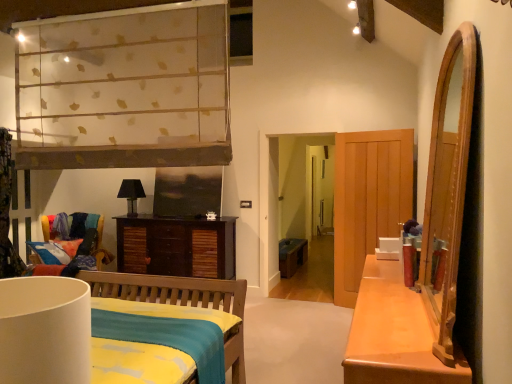
Locate an element on the screen. This screenshot has height=384, width=512. dark brown wood cabinet at center is located at coordinates (176, 246).

What do you see at coordinates (176, 246) in the screenshot?
I see `dark brown wood cabinet at center` at bounding box center [176, 246].

What do you see at coordinates (292, 255) in the screenshot? The width and height of the screenshot is (512, 384). I see `teal fabric bench at center` at bounding box center [292, 255].

Where is `dark brown wood cabinet at center`? This screenshot has width=512, height=384. dark brown wood cabinet at center is located at coordinates (176, 246).

Where is `lamp that appears in front of the dark brown wood cabinet at center`? This screenshot has height=384, width=512. lamp that appears in front of the dark brown wood cabinet at center is located at coordinates (45, 330).

In the image, is dark brown wood cabinet at center on the left side or the right side of white matte lampshade at lower left, the 2th lamp in the left-to-right sequence?

In the image, dark brown wood cabinet at center appears on the left side of white matte lampshade at lower left, the 2th lamp in the left-to-right sequence.

Is dark brown wood cabinet at center located outside white matte lampshade at lower left, which is counted as the 2th lamp, starting from the back?

That's correct, dark brown wood cabinet at center is outside of white matte lampshade at lower left, which is counted as the 2th lamp, starting from the back.

Would you say teal fabric bench at center is outside matte black lampshade at center, the 2th lamp when ordered from right to left?

Yes.

Considering the relative positions of teal fabric bench at center and matte black lampshade at center, the first lamp in the left-to-right sequence, in the image provided, is teal fabric bench at center to the left or to the right of matte black lampshade at center, the first lamp in the left-to-right sequence,?

Based on their positions, teal fabric bench at center is located to the right of matte black lampshade at center, the first lamp in the left-to-right sequence.

Considering the relative sizes of multicolored fabric chair at left and matte black lampshade at center, which ranks as the 2th lamp in front-to-back order, in the image provided, is multicolored fabric chair at left shorter than matte black lampshade at center, which ranks as the 2th lamp in front-to-back order,?

No.

Consider the image. From the image's perspective, is multicolored fabric chair at left located above matte black lampshade at center, the first lamp viewed from the back?

Actually, multicolored fabric chair at left appears below matte black lampshade at center, the first lamp viewed from the back, in the image.

Is multicolored fabric chair at left bigger than matte black lampshade at center, the first lamp in the left-to-right sequence?

Correct, multicolored fabric chair at left is larger in size than matte black lampshade at center, the first lamp in the left-to-right sequence.

Which is in front, point (288, 249) or point (146, 226)?

The point (146, 226) is closer.

From the picture: Is teal fabric bench at center taller or shorter than dark brown wood cabinet at center?

teal fabric bench at center is shorter than dark brown wood cabinet at center.

Choose the correct answer: Is teal fabric bench at center inside dark brown wood cabinet at center or outside it?

teal fabric bench at center is not enclosed by dark brown wood cabinet at center.

Is matte black lampshade at center, which ranks as the 2th lamp in front-to-back order, positioned before white matte lampshade at lower left, the first lamp in the front-to-back sequence?

No, the depth of matte black lampshade at center, which ranks as the 2th lamp in front-to-back order, is greater than that of white matte lampshade at lower left, the first lamp in the front-to-back sequence.

How much distance is there between matte black lampshade at center, the first lamp in the left-to-right sequence, and white matte lampshade at lower left, the first lamp in the front-to-back sequence?

matte black lampshade at center, the first lamp in the left-to-right sequence, and white matte lampshade at lower left, the first lamp in the front-to-back sequence, are 15.18 feet apart.

Would you say matte black lampshade at center, which ranks as the 2th lamp in front-to-back order, is a long distance from white matte lampshade at lower left, which is counted as the 2th lamp, starting from the back?

Absolutely, matte black lampshade at center, which ranks as the 2th lamp in front-to-back order, is distant from white matte lampshade at lower left, which is counted as the 2th lamp, starting from the back.

From the image's perspective, is matte black lampshade at center, which ranks as the 2th lamp in front-to-back order, above or below white matte lampshade at lower left, the 1th lamp in the right-to-left sequence?

Based on their image positions, matte black lampshade at center, which ranks as the 2th lamp in front-to-back order, is located above white matte lampshade at lower left, the 1th lamp in the right-to-left sequence.

Is there a large distance between multicolored fabric chair at left and white matte lampshade at lower left, the 2th lamp in the left-to-right sequence?

Absolutely, multicolored fabric chair at left is distant from white matte lampshade at lower left, the 2th lamp in the left-to-right sequence.

Between multicolored fabric chair at left and white matte lampshade at lower left, the 1th lamp in the right-to-left sequence, which one has larger size?

multicolored fabric chair at left.

Looking at this image, is multicolored fabric chair at left wider or thinner than white matte lampshade at lower left, the 1th lamp in the right-to-left sequence?

Considering their sizes, multicolored fabric chair at left looks broader than white matte lampshade at lower left, the 1th lamp in the right-to-left sequence.

Is teal fabric bench at center not near white matte lampshade at lower left, the 1th lamp in the right-to-left sequence?

Yes.

From the image's perspective, is teal fabric bench at center below white matte lampshade at lower left, which is counted as the 2th lamp, starting from the back?

Yes, from the image's perspective, teal fabric bench at center is below white matte lampshade at lower left, which is counted as the 2th lamp, starting from the back.

Is point (305, 241) behind point (26, 353)?

Yes.

The width and height of the screenshot is (512, 384). I want to click on lamp on the right of dark brown wood cabinet at center, so click(x=45, y=330).

Find the location of a particular element. studio couch beneath the matte black lampshade at center, the first lamp viewed from the back (from a real-world perspective) is located at coordinates (292, 255).

Which object lies nearer to the anchor point teal fabric bench at center, multicolored fabric chair at left or white matte lampshade at lower left, the 2th lamp in the left-to-right sequence?

Based on the image, multicolored fabric chair at left appears to be nearer to teal fabric bench at center.

Considering their positions, is multicolored fabric chair at left positioned further to dark brown wood cabinet at center than white matte lampshade at lower left, which is counted as the 2th lamp, starting from the back?

Result: The object further to dark brown wood cabinet at center is white matte lampshade at lower left, which is counted as the 2th lamp, starting from the back.

Estimate the real-world distances between objects in this image. Which object is further from multicolored fabric chair at left, white matte lampshade at lower left, the 1th lamp in the right-to-left sequence, or dark brown wood cabinet at center?

white matte lampshade at lower left, the 1th lamp in the right-to-left sequence.

Based on their spatial positions, is matte black lampshade at center, the first lamp viewed from the back, or multicolored fabric chair at left closer to white matte lampshade at lower left, which is counted as the 2th lamp, starting from the back?

multicolored fabric chair at left is positioned closer to the anchor white matte lampshade at lower left, which is counted as the 2th lamp, starting from the back.

From the image, which object appears to be farther from teal fabric bench at center, white matte lampshade at lower left, the 1th lamp in the right-to-left sequence, or multicolored fabric chair at left?

white matte lampshade at lower left, the 1th lamp in the right-to-left sequence, is further to teal fabric bench at center.

Considering their positions, is white matte lampshade at lower left, the 1th lamp in the right-to-left sequence, positioned closer to teal fabric bench at center than dark brown wood cabinet at center?

dark brown wood cabinet at center lies closer to teal fabric bench at center than the other object.

Looking at the image, which one is located further to matte black lampshade at center, which ranks as the 2th lamp in front-to-back order, multicolored fabric chair at left or white matte lampshade at lower left, the 2th lamp in the left-to-right sequence?

white matte lampshade at lower left, the 2th lamp in the left-to-right sequence, is positioned further to the anchor matte black lampshade at center, which ranks as the 2th lamp in front-to-back order.

Which object lies further to the anchor point matte black lampshade at center, the 2th lamp when ordered from right to left, teal fabric bench at center or multicolored fabric chair at left?

teal fabric bench at center is positioned further to the anchor matte black lampshade at center, the 2th lamp when ordered from right to left.

Where is `cabinetry situated between matte black lampshade at center, the first lamp viewed from the back, and teal fabric bench at center from left to right`? cabinetry situated between matte black lampshade at center, the first lamp viewed from the back, and teal fabric bench at center from left to right is located at coordinates (176, 246).

This screenshot has width=512, height=384. I want to click on lamp positioned between white matte lampshade at lower left, the 1th lamp in the right-to-left sequence, and teal fabric bench at center from near to far, so click(131, 194).

Identify the location of chair between white matte lampshade at lower left, the 2th lamp in the left-to-right sequence, and matte black lampshade at center, the first lamp viewed from the back, from front to back. The width and height of the screenshot is (512, 384). point(100,248).

Find the location of a particular element. cabinetry positioned between white matte lampshade at lower left, which is counted as the 2th lamp, starting from the back, and matte black lampshade at center, the 2th lamp when ordered from right to left, from near to far is located at coordinates [176, 246].